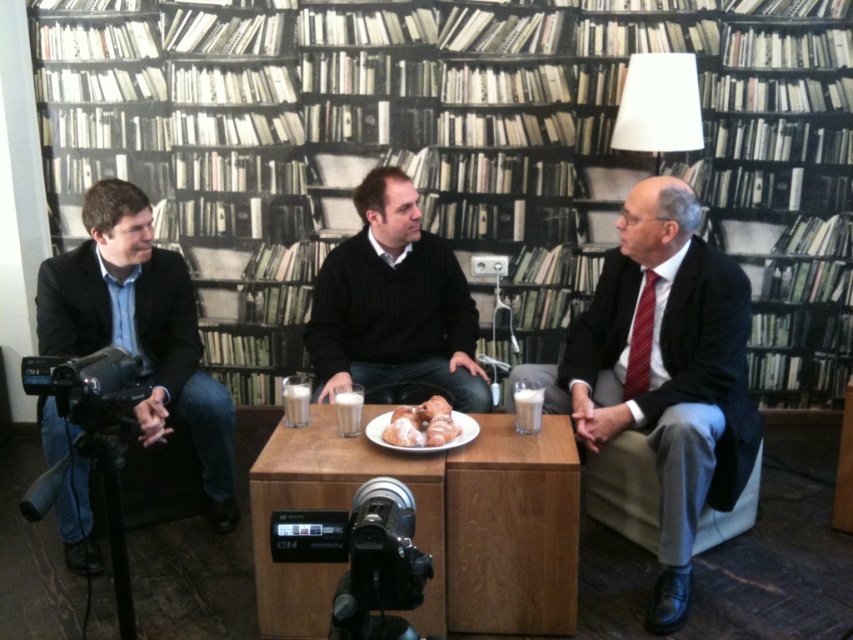
You are a photographer setting up for a shoot in this library scene. You need to place a small lamp between the wooden table at center and the black sweater at center. Based on their positions, where should you place the lamp?

The wooden table at center is closer to the viewer than the black sweater at center, so you should place the lamp between them by positioning it closer to the wooden table at center to maintain the spatial relationship.

You are a photographer trying to capture a candid shot of the black sweater at center without including the wooden table at center in the frame. Is this possible given their positions?

The wooden table at center is below the black sweater at center, so you can position your camera to focus on the black sweater at center while angling it to avoid the table below.

You are a person who is 1.8 meters tall and wants to film a video from the camera position shown in the image. The wooden table at center is in your way. Can you step back enough to film the entire scene without moving the table?

The wooden table at center is 2.05 meters away from the camera. Since you are 1.8 meters tall, stepping back a few steps would allow you to film the entire scene without moving the table.